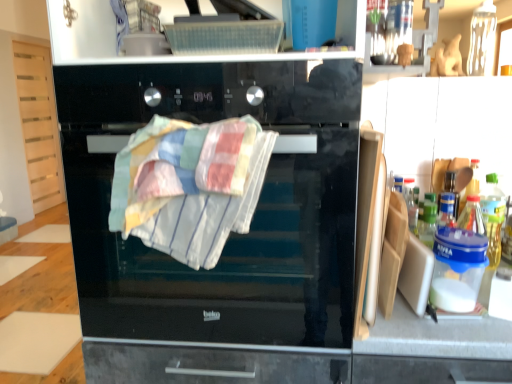
Question: Does multicolored woven towel at center come in front of black glass oven at center?

Choices:
 (A) yes
 (B) no

Answer: (A)

Question: From the image's perspective, is multicolored woven towel at center on black glass oven at center?

Choices:
 (A) yes
 (B) no

Answer: (B)

Question: Can you confirm if multicolored woven towel at center is shorter than black glass oven at center?

Choices:
 (A) yes
 (B) no

Answer: (A)

Question: Is multicolored woven towel at center aimed at black glass oven at center?

Choices:
 (A) no
 (B) yes

Answer: (A)

Question: From a real-world perspective, is multicolored woven towel at center positioned over black glass oven at center based on gravity?

Choices:
 (A) yes
 (B) no

Answer: (A)

Question: Is point (147, 119) closer or farther from the camera than point (480, 198)?

Choices:
 (A) farther
 (B) closer

Answer: (B)

Question: In terms of height, does black glass oven at center look taller or shorter compared to translucent plastic bottle at right?

Choices:
 (A) short
 (B) tall

Answer: (B)

Question: From a real-world perspective, is black glass oven at center positioned above or below translucent plastic bottle at right?

Choices:
 (A) below
 (B) above

Answer: (B)

Question: Which is correct: black glass oven at center is inside translucent plastic bottle at right, or outside of it?

Choices:
 (A) outside
 (B) inside

Answer: (A)

Question: Do you think translucent plastic bottle at right is within black glass oven at center, or outside of it?

Choices:
 (A) inside
 (B) outside

Answer: (B)

Question: Considering the positions of translucent plastic bottle at right and black glass oven at center in the image, is translucent plastic bottle at right wider or thinner than black glass oven at center?

Choices:
 (A) wide
 (B) thin

Answer: (B)

Question: Considering the positions of point (492, 221) and point (91, 273), is point (492, 221) closer or farther from the camera than point (91, 273)?

Choices:
 (A) closer
 (B) farther

Answer: (B)

Question: In the image, is translucent plastic bottle at right positioned in front of or behind black glass oven at center?

Choices:
 (A) front
 (B) behind

Answer: (B)

Question: Is multicolored woven towel at center inside or outside of black glass oven at center?

Choices:
 (A) inside
 (B) outside

Answer: (A)

Question: Relative to black glass oven at center, is multicolored woven towel at center in front or behind?

Choices:
 (A) behind
 (B) front

Answer: (B)